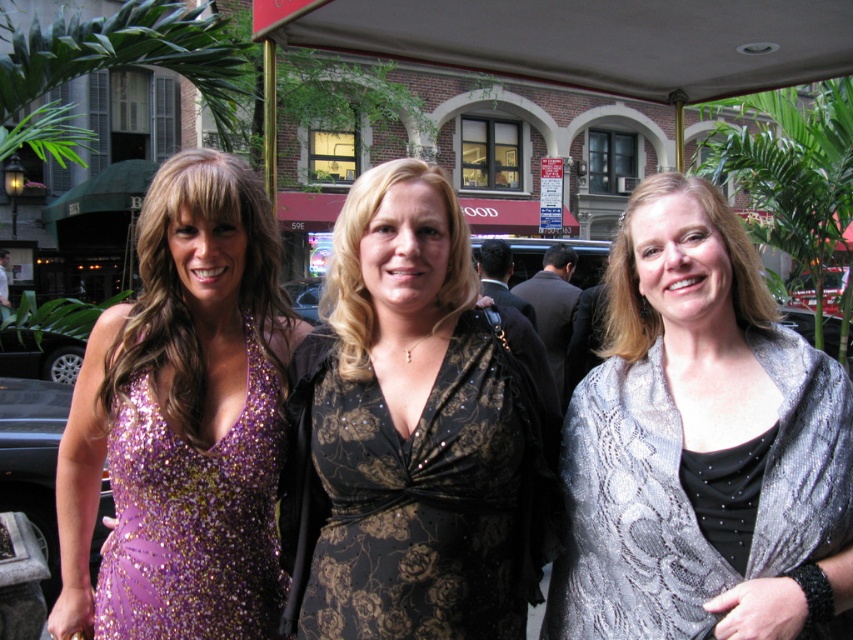
Question: Is white fabric canopy at upper center thinner than lavender sequined dress at left?

Choices:
 (A) yes
 (B) no

Answer: (B)

Question: Which object appears farthest from the camera in this image?

Choices:
 (A) lavender sequined dress at left
 (B) silver sequined shawl at center
 (C) white fabric canopy at upper center
 (D) black sequined dress at center

Answer: (C)

Question: Is black sequined dress at center below lavender sequined dress at left?

Choices:
 (A) no
 (B) yes

Answer: (A)

Question: Which object is the farthest from the silver sequined shawl at center?

Choices:
 (A) black sequined dress at center
 (B) white fabric canopy at upper center
 (C) lavender sequined dress at left

Answer: (B)

Question: Considering the real-world distances, which object is closest to the silver sequined shawl at center?

Choices:
 (A) white fabric canopy at upper center
 (B) black sequined dress at center

Answer: (B)

Question: Is black sequined dress at center smaller than lavender sequined dress at left?

Choices:
 (A) no
 (B) yes

Answer: (A)